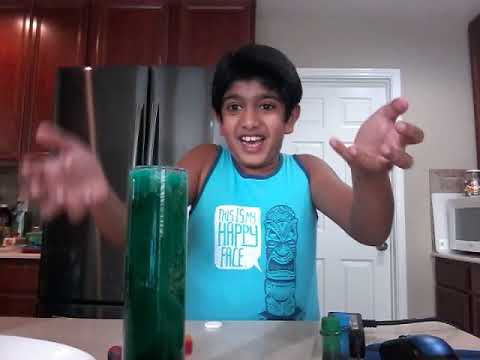
Find the location of a particular element. The image size is (480, 360). wooden cupboard door is located at coordinates (7, 45), (68, 37), (134, 42), (220, 34).